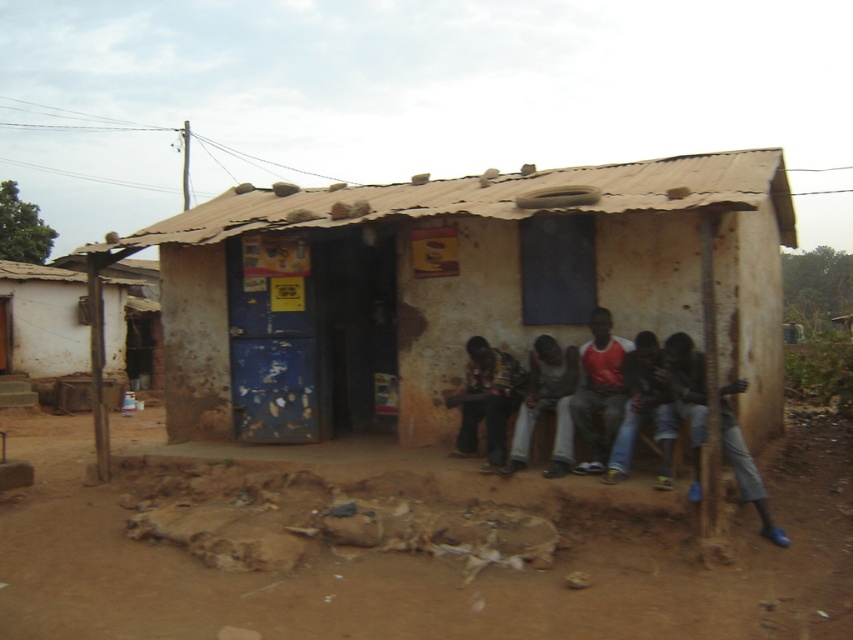
Question: Among these objects, which one is nearest to the camera?

Choices:
 (A) brown mud hut at center
 (B) dark gray fabric pants at center

Answer: (A)

Question: Is brown dirt field at lower center to the left of jeans at center from the viewer's perspective?

Choices:
 (A) yes
 (B) no

Answer: (B)

Question: Does brown mud hut at center appear over blue denim pants at lower right?

Choices:
 (A) no
 (B) yes

Answer: (B)

Question: Among these objects, which one is nearest to the camera?

Choices:
 (A) dark gray fabric pants at lower center
 (B) jeans at center
 (C) blue denim pants at lower right
 (D) brown dirt field at lower center

Answer: (D)

Question: Can you confirm if white corrugated metal hut at left is positioned above dark brown leather jacket at center?

Choices:
 (A) no
 (B) yes

Answer: (B)

Question: Which object is farther from the camera taking this photo?

Choices:
 (A) dark gray fabric pants at center
 (B) jeans at center
 (C) blue denim pants at lower right
 (D) brown dirt field at lower center

Answer: (A)